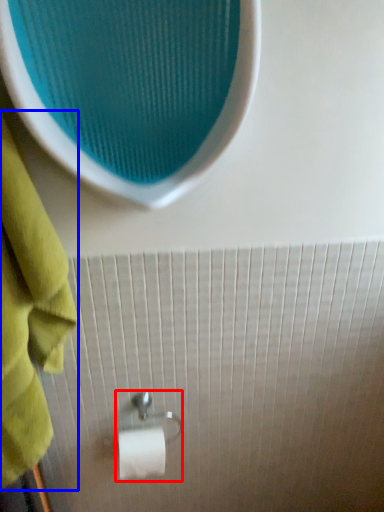
Question: Which of the following is the farthest to the observer, towel bar (highlighted by a red box) or towel (highlighted by a blue box)?

Choices:
 (A) towel bar
 (B) towel

Answer: (A)